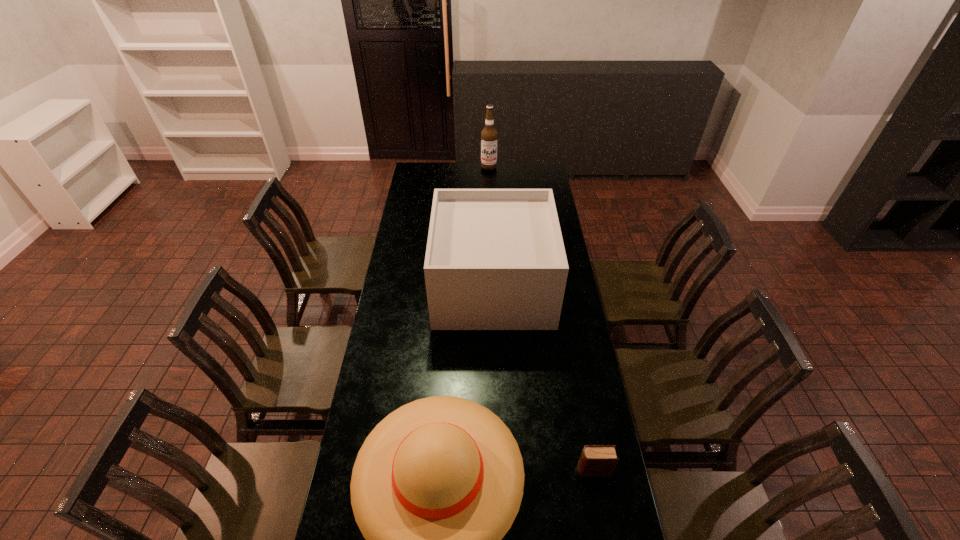
Locate an element on the screen. alcohol is located at coordinates (489, 136).

In order to click on the third nearest object in this screenshot , I will do `click(495, 259)`.

You are a GUI agent. You are given a task and a screenshot of the screen. Output one action in this format:
    pyautogui.click(x=<x>, y=<y>)
    Task: Click on the diary
    This screenshot has height=540, width=960.
    Given the screenshot: What is the action you would take?
    pyautogui.click(x=596, y=460)

You are a GUI agent. You are given a task and a screenshot of the screen. Output one action in this format:
    pyautogui.click(x=<x>, y=<y>)
    Task: Click on the free location located on the label of the alcohol
    
    Given the screenshot: What is the action you would take?
    pyautogui.click(x=490, y=200)

Locate an element on the screen. free region located 0.090m on the side of the box with the window is located at coordinates (416, 285).

Image resolution: width=960 pixels, height=540 pixels. What are the coordinates of `blank area located on the side of the box with the window` in the screenshot? It's located at (416, 285).

Locate an element on the screen. This screenshot has width=960, height=540. free space located on the side of the box with the window is located at coordinates (422, 285).

Identify the location of vacant space located on the spine side of the shortest object. (454, 470).

This screenshot has width=960, height=540. Find the location of `free region located 0.370m on the spine side of the shortest object`. free region located 0.370m on the spine side of the shortest object is located at coordinates (461, 470).

Locate an element on the screen. The image size is (960, 540). vacant region located on the spine side of the shortest object is located at coordinates (504, 470).